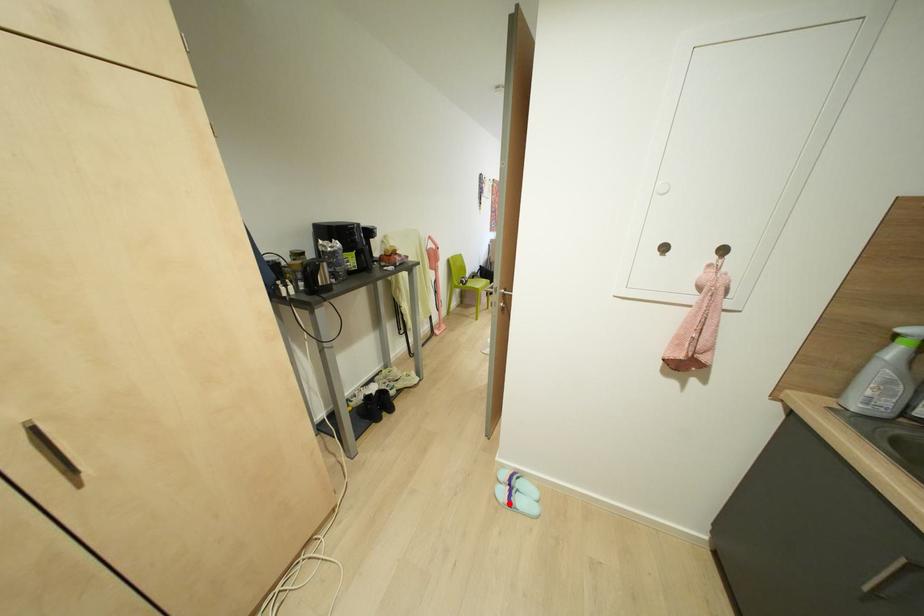
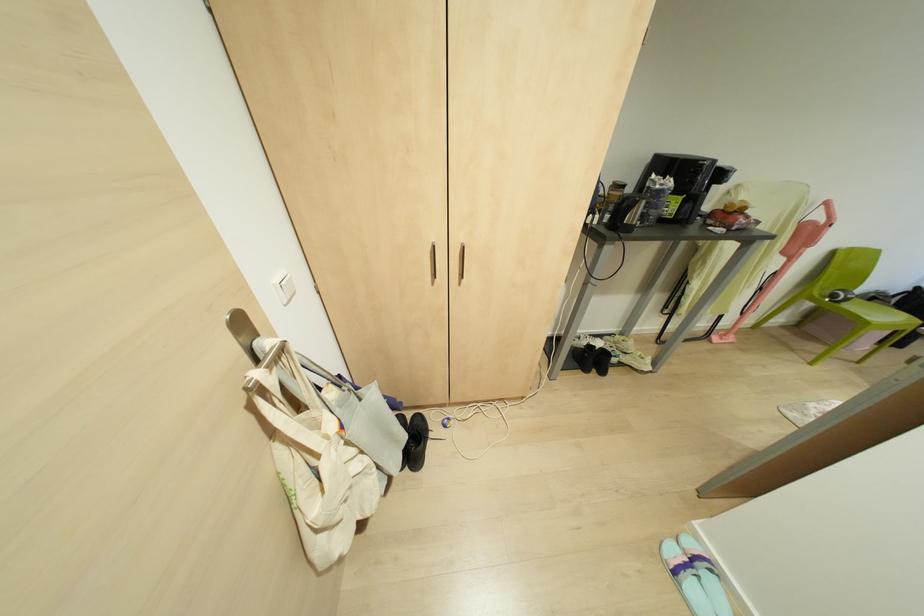
Where in the second image is the point corresponding to the highlighted location from the first image?

(675, 572)